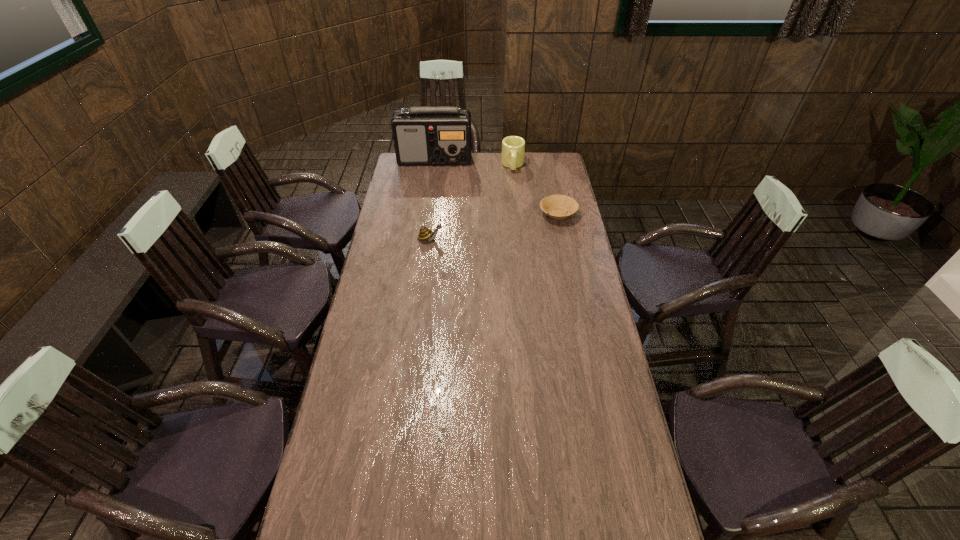
Image resolution: width=960 pixels, height=540 pixels. Find the location of `the nearest object`. the nearest object is located at coordinates (424, 234).

At what (x,y) coordinates should I click in order to perform the action: click on the shortest object. Please return your answer as a coordinate pair (x, y). Looking at the image, I should click on (559, 207).

At what (x,y) coordinates should I click in order to perform the action: click on the second nearest object. Please return your answer as a coordinate pair (x, y). Looking at the image, I should click on (559, 207).

This screenshot has width=960, height=540. In order to click on mug in this screenshot , I will do `click(513, 147)`.

Find the location of a particular element. the tallest object is located at coordinates (427, 135).

Locate an element on the screen. vacant space situated 0.160m on the face of the nearest object is located at coordinates (480, 239).

Locate an element on the screen. The height and width of the screenshot is (540, 960). vacant space located on the left of the shortest object is located at coordinates (522, 214).

Identify the location of vacant space positioned 0.070m with the handle on the side of the mug. (514, 181).

This screenshot has width=960, height=540. I want to click on free space located with the handle on the side of the mug, so click(x=514, y=185).

The height and width of the screenshot is (540, 960). In order to click on vacant space located with the handle on the side of the mug in this screenshot , I will do `click(514, 183)`.